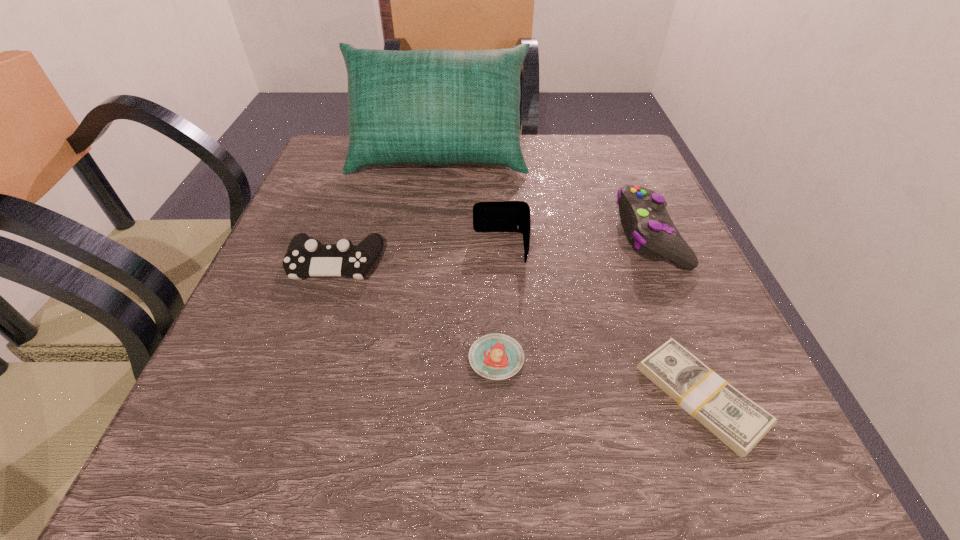
You are a GUI agent. You are given a task and a screenshot of the screen. Output one action in this format:
    pyautogui.click(x=<x>, y=<y>)
    Task: Click on the vacant area that lies between the wallet and the left control
    Image resolution: width=960 pixels, height=540 pixels.
    Given the screenshot: What is the action you would take?
    pyautogui.click(x=419, y=256)

At what (x,y) coordinates should I click in order to perform the action: click on object that is the nearest to the wallet. Please return your answer as a coordinate pair (x, y). The height and width of the screenshot is (540, 960). Looking at the image, I should click on click(x=495, y=356).

Locate an element on the screen. This screenshot has height=540, width=960. object that is the fifth closest to the wallet is located at coordinates (737, 421).

The image size is (960, 540). What are the coordinates of `free location that satisfies the following two spatial constraints: 1. on the surface of the shorter control; 2. on the right side of the second shortest object` in the screenshot? It's located at (303, 358).

This screenshot has height=540, width=960. I want to click on vacant region that satisfies the following two spatial constraints: 1. on the outer surface of the dollar; 2. on the left side of the wallet, so click(508, 396).

At what (x,y) coordinates should I click in order to perform the action: click on blank area in the image that satisfies the following two spatial constraints: 1. on the front-facing side of the shortest object; 2. on the left side of the tallest object. Please return your answer as a coordinate pair (x, y). Looking at the image, I should click on (407, 396).

You are a GUI agent. You are given a task and a screenshot of the screen. Output one action in this format:
    pyautogui.click(x=<x>, y=<y>)
    Task: Click on the vacant area in the image that satisfies the following two spatial constraints: 1. on the front-facing side of the taller control; 2. on the right side of the farthest object
    Image resolution: width=960 pixels, height=540 pixels.
    Given the screenshot: What is the action you would take?
    pyautogui.click(x=428, y=235)

This screenshot has width=960, height=540. Identify the location of vacant position in the image that satisfies the following two spatial constraints: 1. on the front-facing side of the farthest object; 2. on the left side of the fifth tallest object. (412, 358).